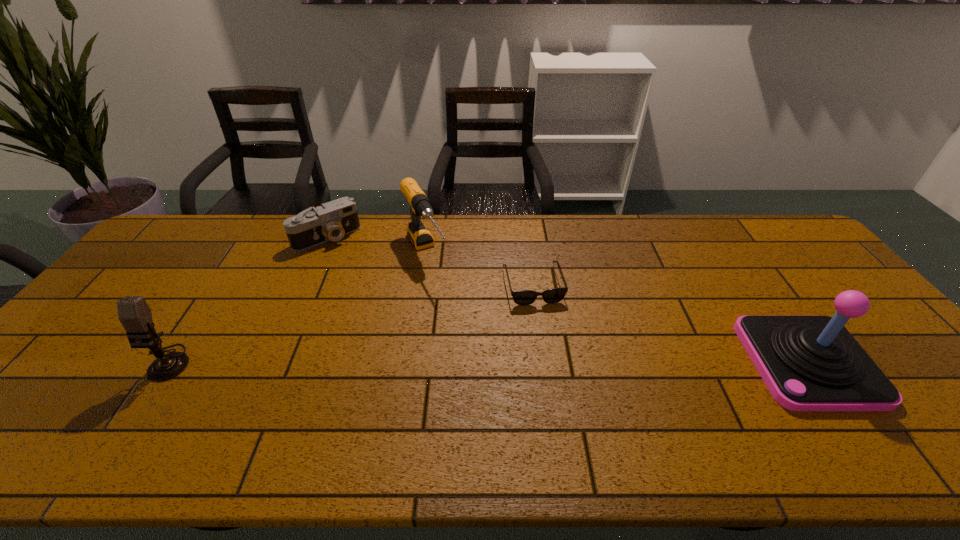
This screenshot has height=540, width=960. Identify the location of free space on the desktop that is between the leftmost object and the joystick and is positioned at the front lenses of the fourth object from left to right. (555, 362).

This screenshot has height=540, width=960. I want to click on vacant spot on the desktop that is between the leftmost object and the rightmost object and is positioned on the handle side of the drill, so click(493, 362).

The height and width of the screenshot is (540, 960). I want to click on free space on the desktop that is between the leftmost object and the joystick and is positioned on the lens of the fourth object from right to left, so click(x=432, y=362).